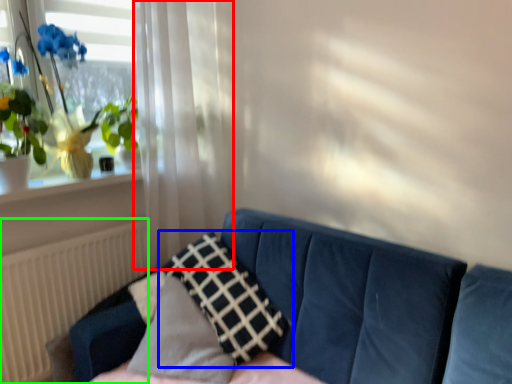
Question: Estimate the real-world distances between objects in this image. Which object is closer to curtain (highlighted by a red box), pillow (highlighted by a blue box) or radiator (highlighted by a green box)?

Choices:
 (A) pillow
 (B) radiator

Answer: (B)